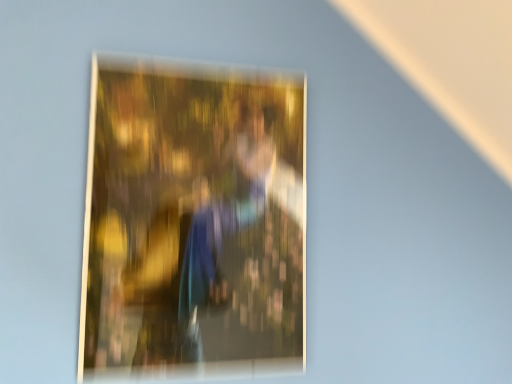
Where is `matte plastic picture frame at center`? matte plastic picture frame at center is located at coordinates (193, 221).

Describe the element at coordinates (193, 221) in the screenshot. I see `matte plastic picture frame at center` at that location.

Locate an element on the screen. The width and height of the screenshot is (512, 384). matte plastic picture frame at center is located at coordinates (193, 221).